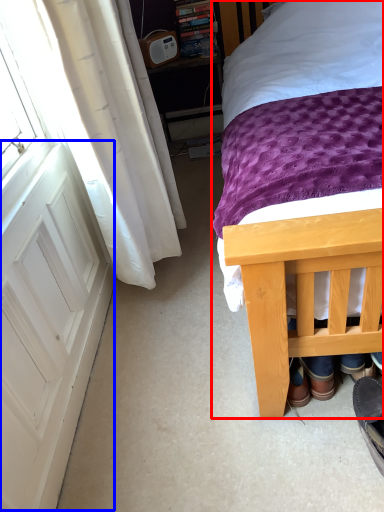
Question: Which object appears farthest to the camera in this image, bed (highlighted by a red box) or screen door (highlighted by a blue box)?

Choices:
 (A) bed
 (B) screen door

Answer: (B)